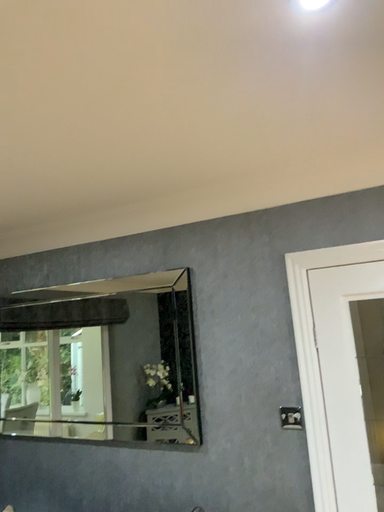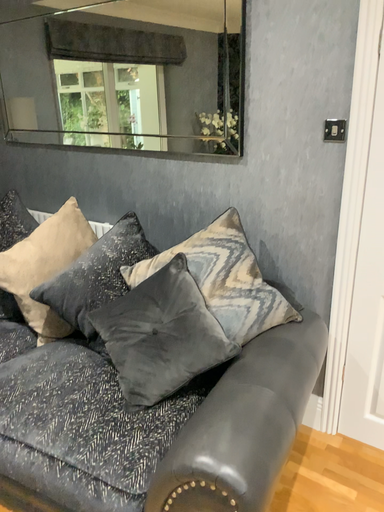
Question: Which way did the camera rotate in the video?

Choices:
 (A) rotated left
 (B) rotated right

Answer: (A)